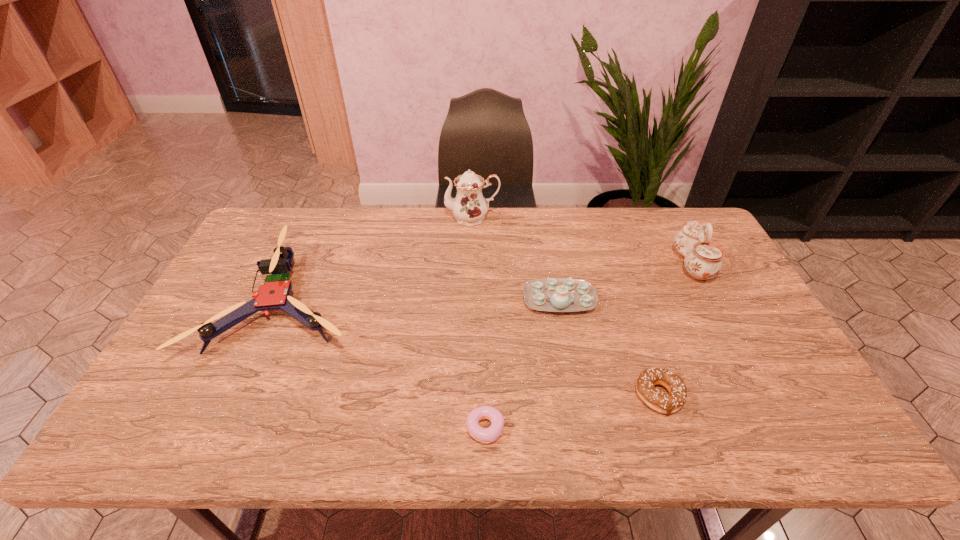
The image size is (960, 540). Find the location of `the shorter doughnut`. the shorter doughnut is located at coordinates (488, 435).

At what (x,y) coordinates should I click in order to perform the action: click on vacant point located 0.100m on the front of the farthest chinaware. Please return your answer as a coordinate pair (x, y). This screenshot has height=540, width=960. Looking at the image, I should click on (471, 247).

In order to click on vacant position located 0.360m by the handle of the rightmost object in this screenshot , I will do `click(563, 265)`.

I want to click on vacant region located by the handle of the rightmost object, so coord(588,265).

This screenshot has width=960, height=540. I want to click on vacant area situated by the handle of the rightmost object, so click(x=635, y=265).

This screenshot has height=540, width=960. I want to click on free spot located on the right of the drone, so click(455, 301).

Locate an element on the screen. The width and height of the screenshot is (960, 540). vacant space located 0.050m on the back of the third shortest object is located at coordinates (554, 272).

What are the coordinates of `free space located on the right of the fifth tallest object` in the screenshot? It's located at (708, 395).

This screenshot has height=540, width=960. I want to click on vacant area situated on the left of the shorter doughnut, so click(444, 428).

Where is `drone that is at the far edge`? drone that is at the far edge is located at coordinates pos(274,293).